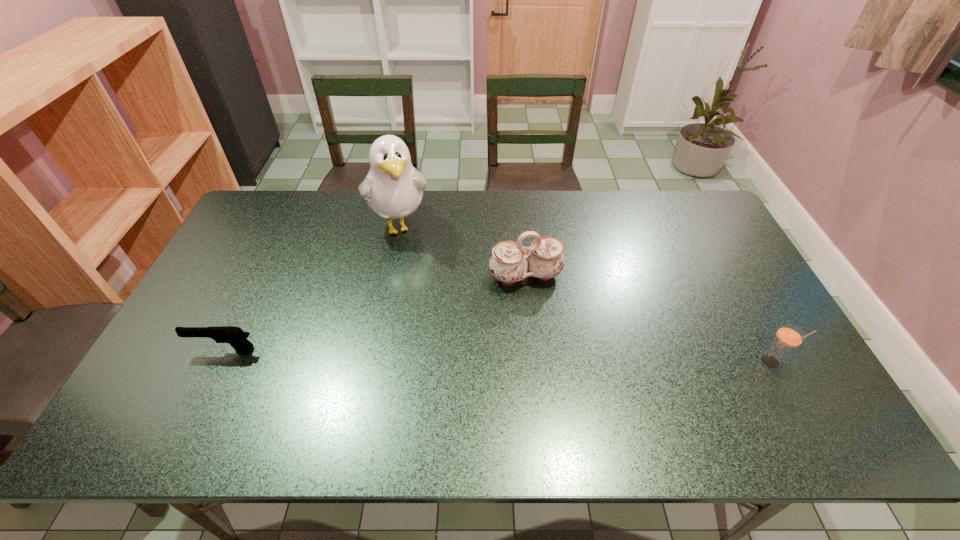
Locate an element on the screen. vacant region located 0.130m on the beak of the gull is located at coordinates (414, 278).

Identify the location of free space located by the handle of the chinaware. The width and height of the screenshot is (960, 540). (557, 361).

Where is `vacant space located by the handle of the chinaware`? Image resolution: width=960 pixels, height=540 pixels. vacant space located by the handle of the chinaware is located at coordinates (566, 389).

Find the location of a particular element. This screenshot has width=960, height=540. vacant space located by the handle of the chinaware is located at coordinates (548, 336).

Where is `object situated at the far edge`? The width and height of the screenshot is (960, 540). object situated at the far edge is located at coordinates (393, 188).

Where is `object at the near edge`? The height and width of the screenshot is (540, 960). object at the near edge is located at coordinates click(789, 336).

Image resolution: width=960 pixels, height=540 pixels. In order to click on object present at the left edge in this screenshot , I will do `click(235, 336)`.

Find the location of a particular element. Image resolution: width=960 pixels, height=540 pixels. object that is at the right edge is located at coordinates pyautogui.click(x=789, y=336).

Where is `object that is at the near right corner`? The image size is (960, 540). object that is at the near right corner is located at coordinates (789, 336).

In order to click on vacant point at the far edge in this screenshot , I will do `click(331, 227)`.